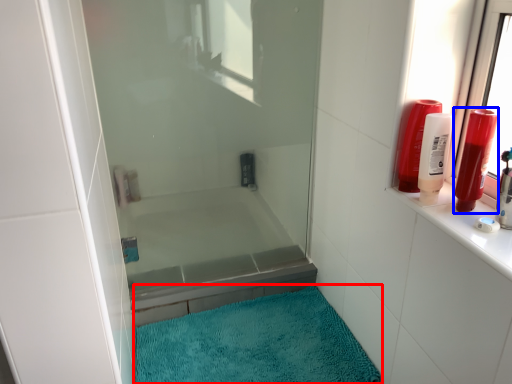
Question: Which point is further to the camera, bath mat (highlighted by a red box) or toiletry (highlighted by a blue box)?

Choices:
 (A) bath mat
 (B) toiletry

Answer: (A)